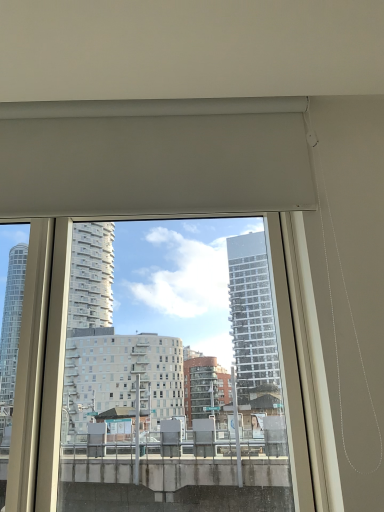
What do you see at coordinates (171, 371) in the screenshot? This screenshot has width=384, height=512. I see `transparent glass window at center` at bounding box center [171, 371].

Where is `transparent glass window at center`? This screenshot has width=384, height=512. transparent glass window at center is located at coordinates (171, 371).

In order to face transparent glass window at center, should I rotate leftwards or rightwards?

A 3.136 degree turn to the left will do.

Where is `transparent glass window at center`? transparent glass window at center is located at coordinates (171, 371).